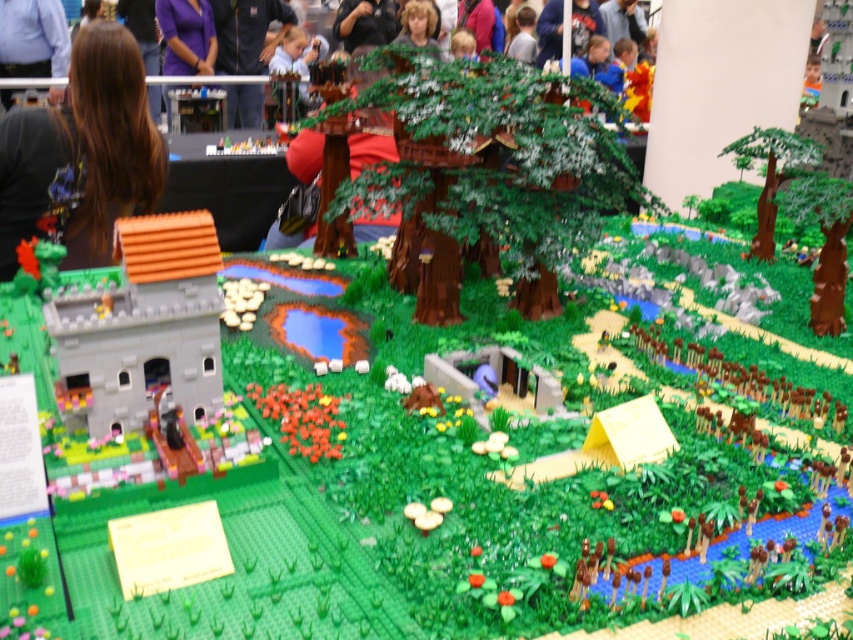
Question: Does green matte tree at center appear on the right side of brown hair at upper left?

Choices:
 (A) yes
 (B) no

Answer: (A)

Question: Which object is the closest to the brown textured tree at right?

Choices:
 (A) brown hair at upper left
 (B) green matte tree at upper right
 (C) green matte tree at center

Answer: (B)

Question: Considering the relative positions of brown hair at upper left and brushed metal shirt at upper left in the image provided, where is brown hair at upper left located with respect to brushed metal shirt at upper left?

Choices:
 (A) below
 (B) above

Answer: (A)

Question: Which point is closer to the camera?

Choices:
 (A) (767, 131)
 (B) (22, 8)
 (C) (477, 188)

Answer: (C)

Question: Which object is the closest to the brown textured tree at right?

Choices:
 (A) brushed metal shirt at upper left
 (B) green matte tree at center
 (C) green matte tree at upper right
 (D) brown hair at upper left

Answer: (C)

Question: Is green matte tree at center to the right of brown textured tree at right from the viewer's perspective?

Choices:
 (A) no
 (B) yes

Answer: (A)